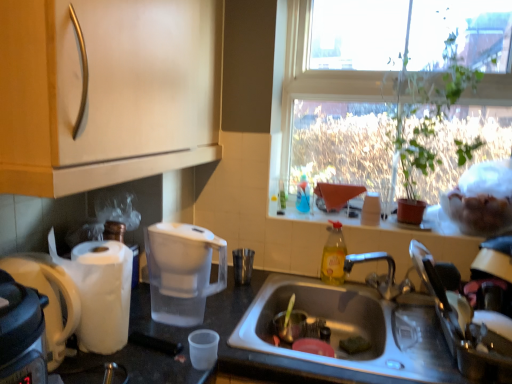
Question: From their relative heights in the image, would you say transparent plastic cup at lower center, which is the 1th coffee cup from front to back, is taller or shorter than brushed metal cup at sink, the first coffee cup viewed from the top?

Choices:
 (A) short
 (B) tall

Answer: (A)

Question: Is transparent plastic cup at lower center, which is counted as the second coffee cup, starting from the right, wider or thinner than brushed metal cup at sink, marked as the second coffee cup in a left-to-right arrangement?

Choices:
 (A) thin
 (B) wide

Answer: (A)

Question: Considering the real-world distances, which object is closest to the transparent plastic water filter at center, the first coffee maker when ordered from back to front?

Choices:
 (A) brushed metal cup at sink, which is the 2th coffee cup from bottom to top
 (B) matte wood cabinet at upper left
 (C) transparent glass window at upper right
 (D) green leafy plant at upper right
 (E) clear glass bottle at upper center

Answer: (B)

Question: Considering the real-world distances, which object is farthest from the matte wood cabinet at upper left?

Choices:
 (A) transparent plastic cup at lower center, which is the 1th coffee cup from front to back
 (B) brushed metal cup at sink, marked as the second coffee cup in a left-to-right arrangement
 (C) yellow translucent bottle at sink, which ranks as the first bottle in front-to-back order
 (D) white plastic coffee maker at left, the first coffee maker when ordered from left to right
 (E) stainless steel sink at lower center

Answer: (C)